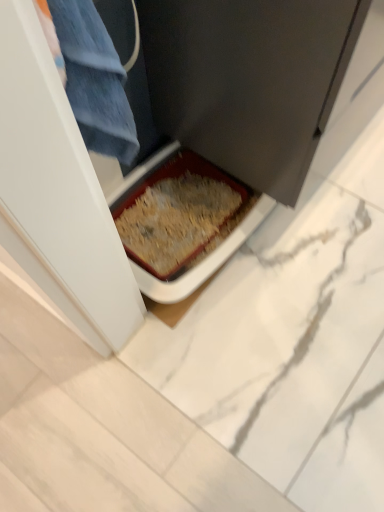
Measure the distance between blue cotton trousers at upper left and camera.

18.11 inches.

At what (x,y) coordinates should I click in order to perform the action: click on blue cotton trousers at upper left. Please return your answer as a coordinate pair (x, y). Image resolution: width=384 pixels, height=512 pixels. Looking at the image, I should click on (95, 80).

What do you see at coordinates (95, 80) in the screenshot? The image size is (384, 512). I see `blue cotton trousers at upper left` at bounding box center [95, 80].

Locate an element on the screen. This screenshot has width=384, height=512. blue cotton trousers at upper left is located at coordinates [x=95, y=80].